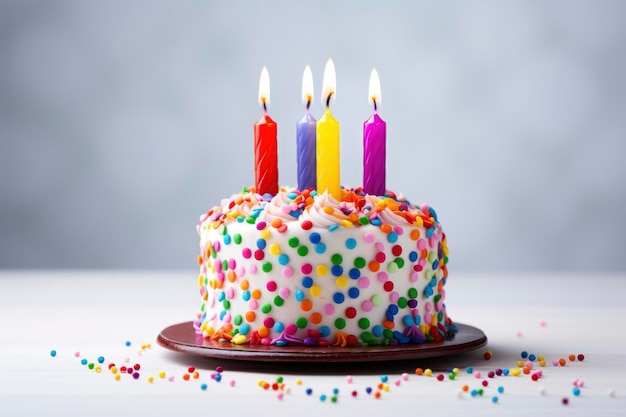
Where is `candle wicks`? The width and height of the screenshot is (626, 417). candle wicks is located at coordinates (264, 106), (308, 105), (324, 99), (374, 106).